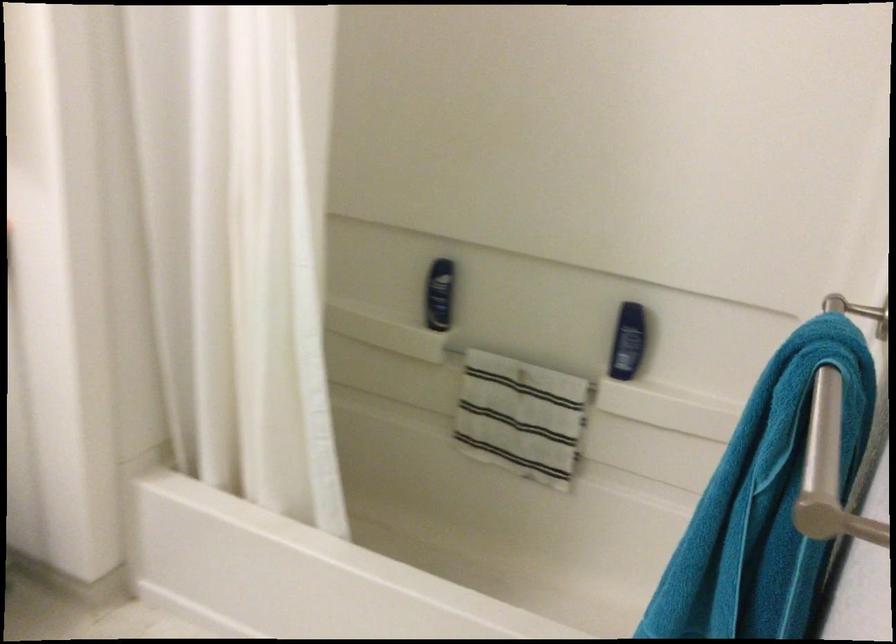
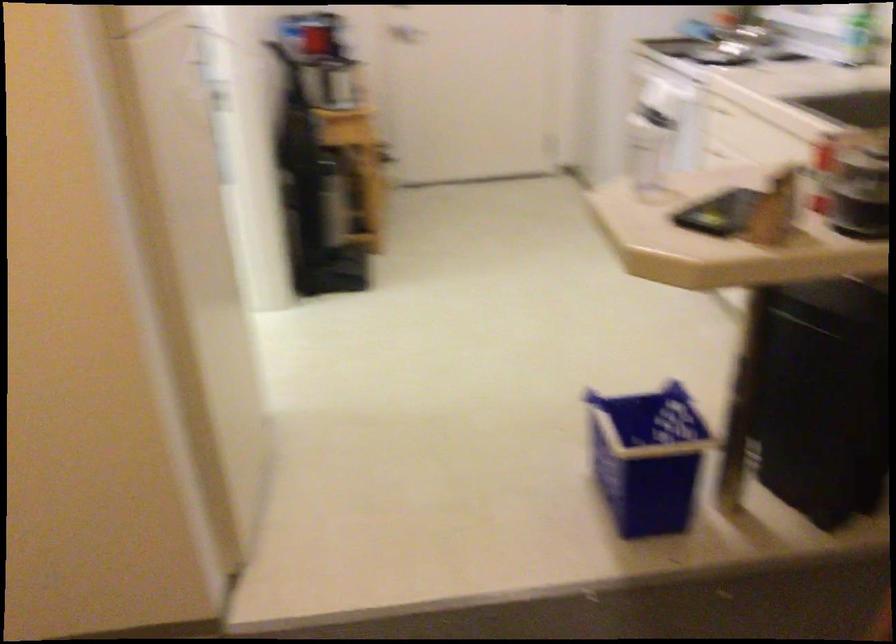
Question: I am providing you with two images of the same scene from different viewpoints. Please identify which objects are invisible in image2.

Choices:
 (A) pink plastic bowl
 (B) blue shampoo bottle
 (C) clear plastic cup
 (D) blue plastic basket

Answer: (B)